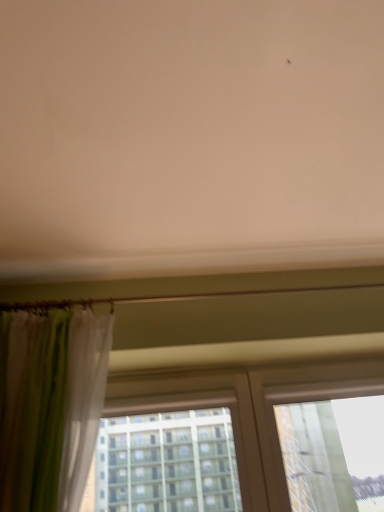
What do you see at coordinates (247, 408) in the screenshot? I see `transparent glass window at center` at bounding box center [247, 408].

Measure the distance between point (261, 425) and camera.

The distance of point (261, 425) from camera is 1.68 meters.

Locate an element on the screen. The width and height of the screenshot is (384, 512). transparent glass window at center is located at coordinates (247, 408).

At what (x,y) coordinates should I click in order to perform the action: click on transparent glass window at center. Please return your answer as a coordinate pair (x, y). The height and width of the screenshot is (512, 384). Looking at the image, I should click on (247, 408).